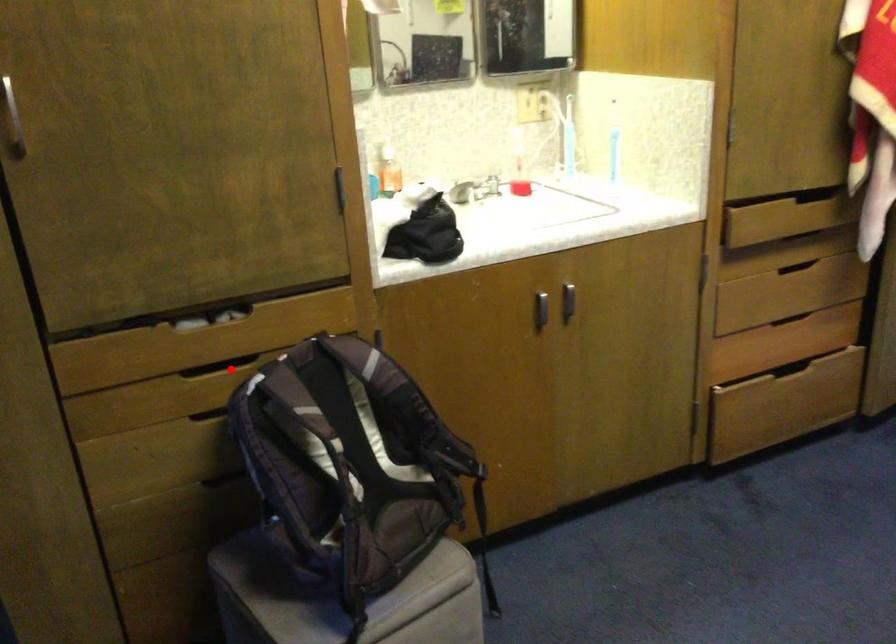
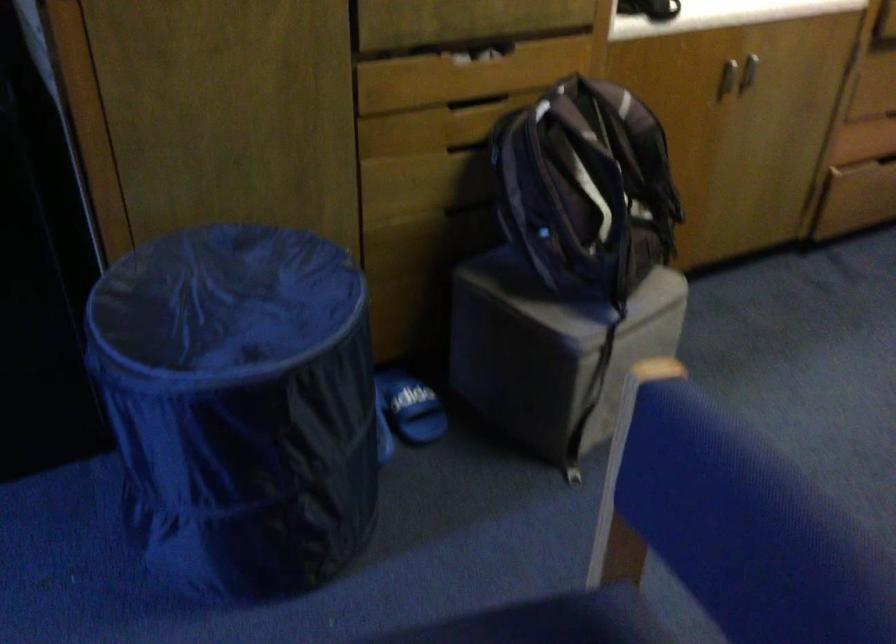
Where in the second image is the point corresponding to the highlighted location from the first image?

(476, 102)